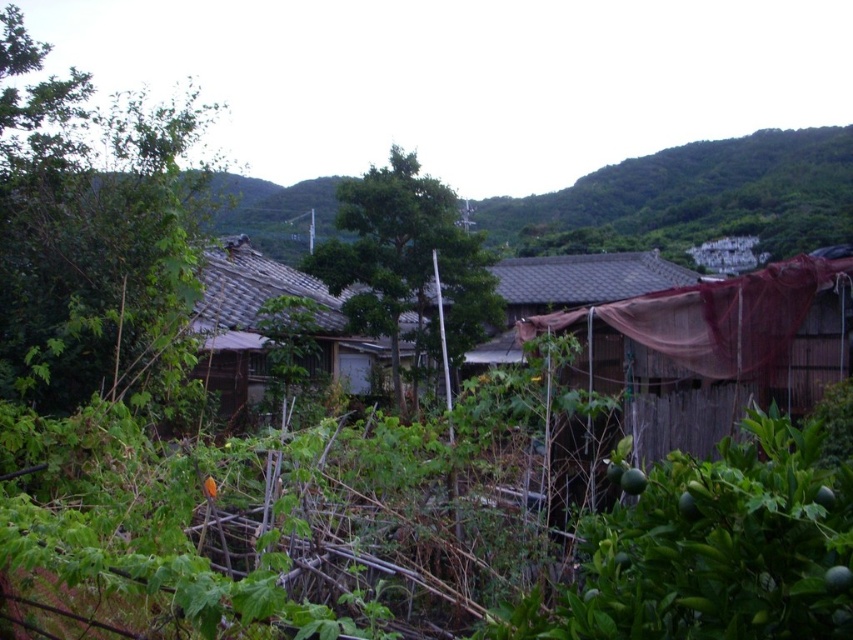
Is green leafy tree at left below brown wooden hut at right?

No, green leafy tree at left is not below brown wooden hut at right.

Which is behind, point (96, 177) or point (838, 356)?

Positioned behind is point (96, 177).

Is point (74, 358) positioned before point (827, 260)?

That is True.

At what (x,y) coordinates should I click in order to perform the action: click on green leafy tree at left. Please return your answer as a coordinate pair (x, y). Looking at the image, I should click on (97, 237).

Does brown wooden hut at right lie in front of brown tile roof hut at center?

Yes, it is.

Consider the image. Between brown wooden hut at right and brown tile roof hut at center, which one is positioned lower?

brown tile roof hut at center is lower down.

Is point (648, 420) behind point (202, 380)?

That is False.

The image size is (853, 640). I want to click on brown wooden hut at right, so click(x=711, y=349).

Is brown wooden hut at right wider than green leafy tree at center?

In fact, brown wooden hut at right might be narrower than green leafy tree at center.

How much distance is there between brown wooden hut at right and green leafy tree at center?

They are 6.73 meters apart.

Find the location of `brown wooden hut at right`. brown wooden hut at right is located at coordinates (711, 349).

Where is `brown wooden hut at right`? This screenshot has width=853, height=640. brown wooden hut at right is located at coordinates point(711,349).